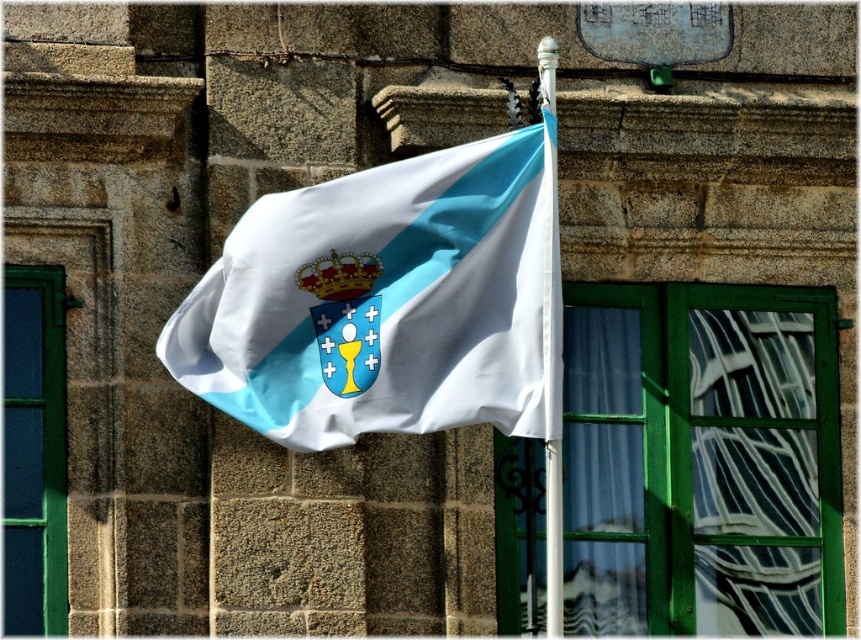
You are standing in front of the stone building and notice the silky white flag at center. Can you determine the exact coordinates where the flag is positioned?

The silky white flag at center is located at point (388, 301), so the coordinates are exactly at 0.473 on the x axis and 0.452 on the y axis.

You are an architect designing a new building and want to ensure the flag pole and crown on the flag are proportionally sized. Given that the white plastic flag pole at center is narrower than the gold metallic crown at center, which object should you scale up to maintain proper proportions if the crown appears too large?

The white plastic flag pole at center is narrower than the gold metallic crown at center. To maintain proper proportions, you should scale up the white plastic flag pole at center to match the size of the crown.